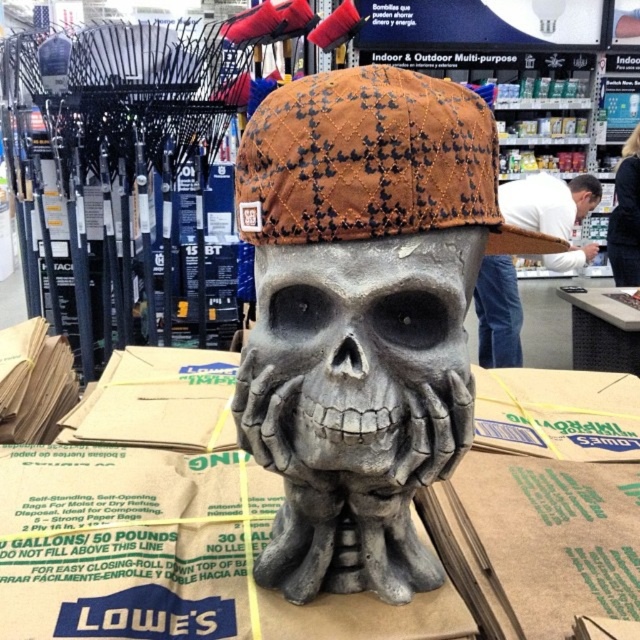
Does white shirt at upper center appear over matte brown cap at upper center?

Incorrect, white shirt at upper center is not positioned above matte brown cap at upper center.

Is point (552, 266) closer to viewer compared to point (568, 180)?

Yes, point (552, 266) is closer to viewer.

Between point (483, 301) and point (580, 196), which one is positioned behind?

Point (580, 196)

Identify the location of white shirt at upper center. (548, 202).

Identify the location of white shirt at upper center. (548, 202).

Is point (490, 317) positioned in front of point (630, 186)?

Yes, point (490, 317) is in front of point (630, 186).

Find the location of a particular element. This screenshot has height=640, width=640. white shirt at upper center is located at coordinates (548, 202).

Is matte brown fabric skull at center to the right of black fabric hair at upper right from the viewer's perspective?

In fact, matte brown fabric skull at center is to the left of black fabric hair at upper right.

The width and height of the screenshot is (640, 640). Identify the location of matte brown fabric skull at center. (362, 314).